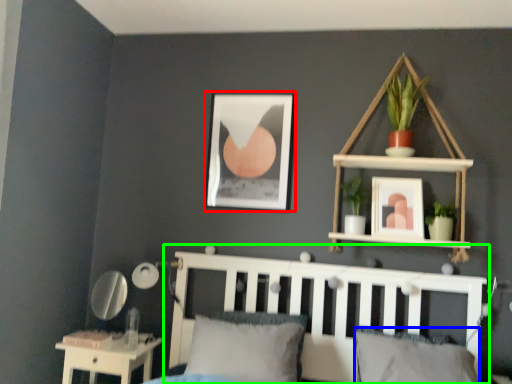
Question: Based on their relative distances, which object is nearer to picture frame (highlighted by a red box)? Choose from pillow (highlighted by a blue box) and bed frame (highlighted by a green box).

Choices:
 (A) pillow
 (B) bed frame

Answer: (B)